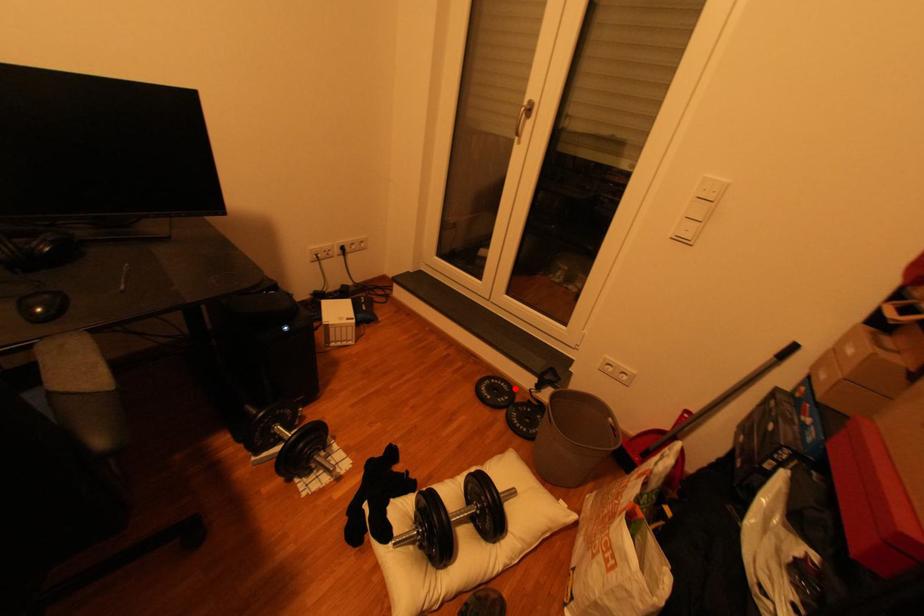
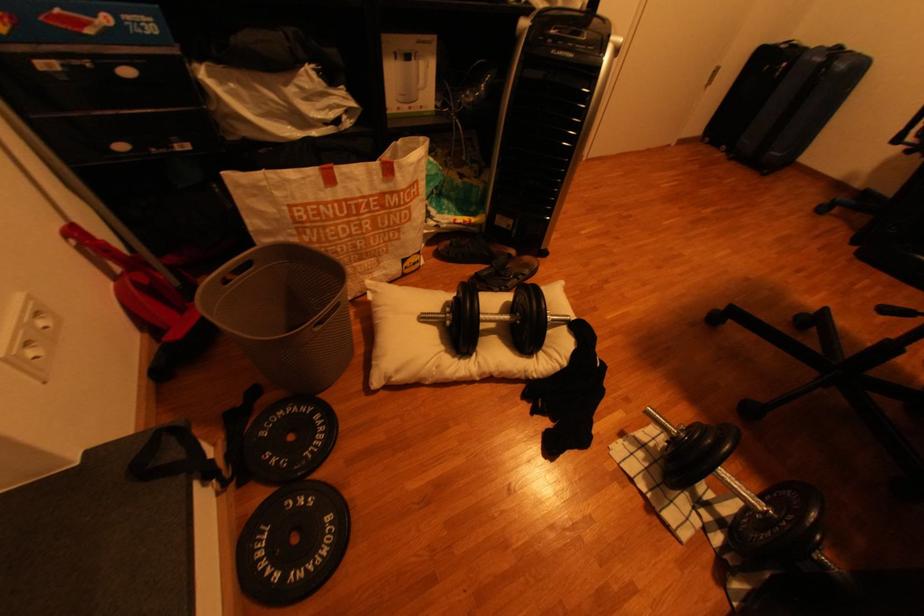
The point at the highlighted location is marked in the first image. Where is the corresponding point in the second image?

(274, 540)